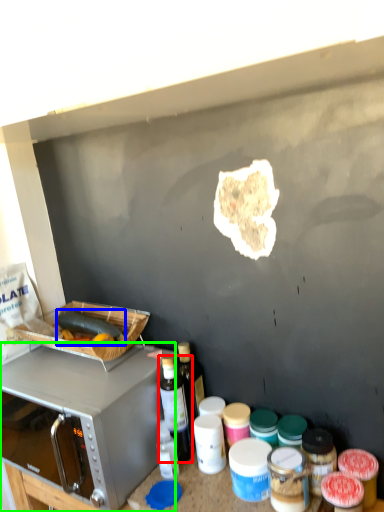
Question: Based on their relative distances, which object is farther from bottle (highlighted by a red box)? Choose from food (highlighted by a blue box) and microwave oven (highlighted by a green box).

Choices:
 (A) food
 (B) microwave oven

Answer: (A)